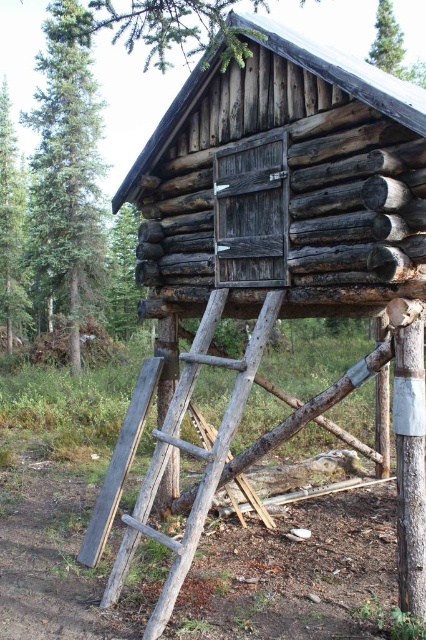
You are a hiker who wants to climb up to the cabin. You see the rustic wood ladder at center and the green leafy tree at upper center. Which object is larger in size?

The rustic wood ladder at center is bigger than green leafy tree at upper center according to the description.

You are standing in front of the rustic wooden cabin and notice two points marked on the structure. The first point is at coordinate point (72, 108) and the second is at point (175, 563). Which point is closer to you as you face the cabin?

Point (72, 108) is closer to you because it is further to the camera than point (175, 563).